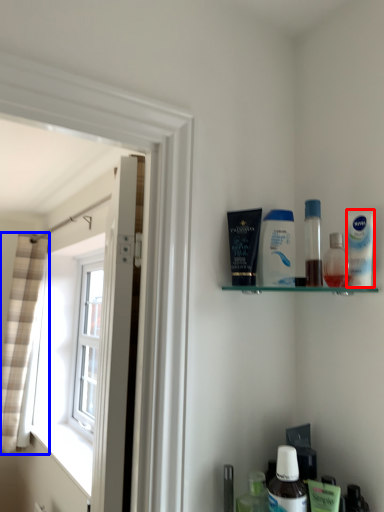
Question: Which of the following is the closest to the observer, mouthwash (highlighted by a red box) or curtain (highlighted by a blue box)?

Choices:
 (A) mouthwash
 (B) curtain

Answer: (A)